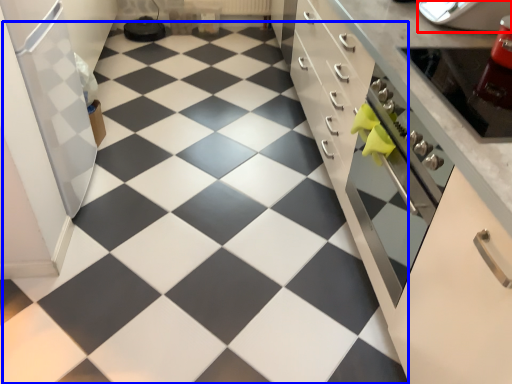
Question: Which of the following is the farthest to the observer, appliance (highlighted by a red box) or tile (highlighted by a blue box)?

Choices:
 (A) appliance
 (B) tile

Answer: (A)